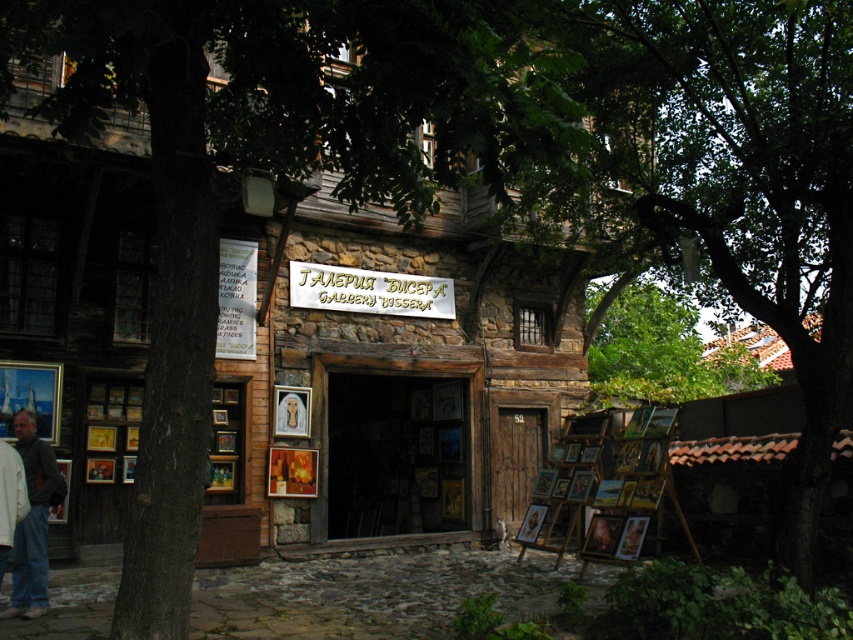
Can you confirm if green leafy tree at upper left is bigger than denim jacket at lower left?

Yes.

Is green leafy tree at upper left to the right of denim jacket at lower left from the viewer's perspective?

Indeed, green leafy tree at upper left is positioned on the right side of denim jacket at lower left.

Between point (543, 19) and point (39, 593), which one is positioned behind?

Positioned behind is point (39, 593).

Image resolution: width=853 pixels, height=640 pixels. In order to click on green leafy tree at upper left in this screenshot , I will do `click(283, 170)`.

Between point (398, 300) and point (38, 520), which one is positioned behind?

Point (398, 300)

Who is positioned more to the right, gold metallic sign at center or denim jacket at lower left?

gold metallic sign at center

Is point (296, 273) positioned behind point (20, 524)?

Yes, it is.

I want to click on gold metallic sign at center, so pyautogui.click(x=369, y=291).

Does green leafy tree at upper left have a larger size compared to gold metallic sign at center?

Yes.

Describe the element at coordinates (283, 170) in the screenshot. I see `green leafy tree at upper left` at that location.

Identify the location of green leafy tree at upper left. This screenshot has height=640, width=853. (283, 170).